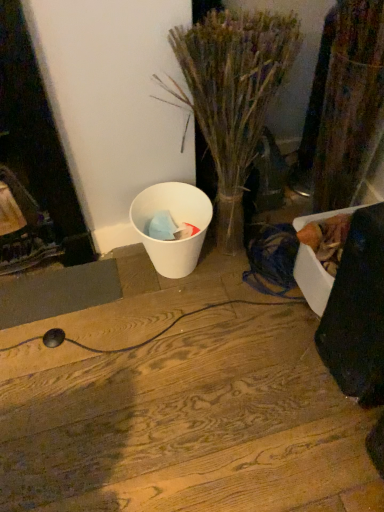
The image size is (384, 512). What are the coordinates of `vacant area that is in front of white matte trash can at lower left` in the screenshot? It's located at (164, 321).